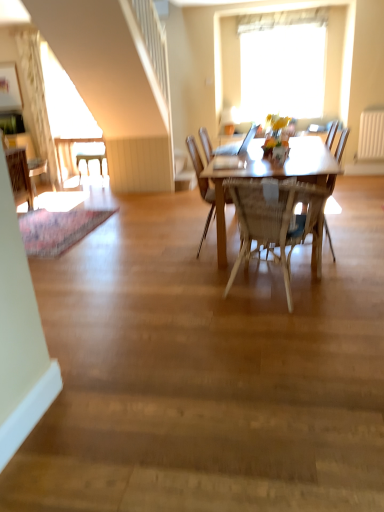
Describe the element at coordinates (279, 155) in the screenshot. I see `matte white vase at center` at that location.

Locate an element on the screen. The width and height of the screenshot is (384, 512). white plastic radiator at right is located at coordinates (371, 135).

In the scene shown: What is the approximate height of woven wood chair at center, marked as the 5th chair in a back-to-front arrangement?

woven wood chair at center, marked as the 5th chair in a back-to-front arrangement, is 30.78 inches in height.

What do you see at coordinates (37, 99) in the screenshot? I see `light beige textured curtain at upper left` at bounding box center [37, 99].

Where is `light beige textured curtain at upper left`? This screenshot has height=512, width=384. light beige textured curtain at upper left is located at coordinates (37, 99).

Where is `wooden chair at center, the 1th chair positioned from the right`? The height and width of the screenshot is (512, 384). wooden chair at center, the 1th chair positioned from the right is located at coordinates (297, 232).

From the image's perspective, relative to wooden chair at left, the fourth chair from the right, is white plastic radiator at right above or below?

white plastic radiator at right is situated higher than wooden chair at left, the fourth chair from the right, in the image.

Which point is more forward, (383,110) or (46,167)?

The point (383,110) is closer.

Can we say white plastic radiator at right lies outside wooden chair at left, the fourth chair from the right?

Yes.

Are white plastic radiator at right and wooden chair at left, the 4th chair positioned from the front, far apart?

Yes, white plastic radiator at right and wooden chair at left, the 4th chair positioned from the front, are located far from each other.

Can you confirm if light brown wooden table at center is thinner than transparent glass window at upper center?

In fact, light brown wooden table at center might be wider than transparent glass window at upper center.

Which point is more distant from viewer, (335, 168) or (249, 78)?

Positioned behind is point (249, 78).

From the image's perspective, which is below, light brown wooden table at center or transparent glass window at upper center?

light brown wooden table at center.

From a real-world perspective, which object stands above the other?

transparent glass window at upper center, from a real-world perspective.

Is transparent glass window at upper center at the right side of light beige textured curtain at upper left?

Indeed, transparent glass window at upper center is positioned on the right side of light beige textured curtain at upper left.

Identify the location of window above the light beige textured curtain at upper left (from the image's perspective). This screenshot has height=512, width=384. (283, 62).

Which of these two, transparent glass window at upper center or light beige textured curtain at upper left, is bigger?

With larger size is transparent glass window at upper center.

How different are the orientations of transparent glass window at upper center and light beige textured curtain at upper left in degrees?

The angle between the facing direction of transparent glass window at upper center and the facing direction of light beige textured curtain at upper left is 0.000721 degrees.

From a real-world perspective, which object stands above the other?

wooden chair at center, which is the fifth chair in left-to-right order, is physically above.

Considering the relative positions of light brown wooden table at center and wooden chair at center, the 1th chair positioned from the right, in the image provided, is light brown wooden table at center to the left or to the right of wooden chair at center, the 1th chair positioned from the right,?

Clearly, light brown wooden table at center is on the left of wooden chair at center, the 1th chair positioned from the right, in the image.

Is light brown wooden table at center turned away from wooden chair at center, the 1th chair positioned from the right?

Yes, light brown wooden table at center is positioned with its back facing wooden chair at center, the 1th chair positioned from the right.

Is woven wood chair at center, marked as the 5th chair in a back-to-front arrangement, turned away from white plastic chair at left, which is counted as the 1th chair, starting from the back?

woven wood chair at center, marked as the 5th chair in a back-to-front arrangement, does not have its back to white plastic chair at left, which is counted as the 1th chair, starting from the back.

Is woven wood chair at center, which appears as the 1th chair when viewed from the front, completely or partially outside of white plastic chair at left, which is counted as the 1th chair, starting from the back?

Yes, woven wood chair at center, which appears as the 1th chair when viewed from the front, is outside of white plastic chair at left, which is counted as the 1th chair, starting from the back.

Is woven wood chair at center, which appears as the 1th chair when viewed from the front, thinner than white plastic chair at left, which is the 5th chair from front to back?

No, woven wood chair at center, which appears as the 1th chair when viewed from the front, is not thinner than white plastic chair at left, which is the 5th chair from front to back.

Is woven wood chair at center, the 2th chair viewed from the right, taller than white plastic chair at left, which is the 5th chair from front to back?

Indeed, woven wood chair at center, the 2th chair viewed from the right, has a greater height compared to white plastic chair at left, which is the 5th chair from front to back.

Is wooden chair at center, the 1th chair positioned from the right, situated inside wooden chair at left, the 2th chair positioned from the back, or outside?

The correct answer is: outside.

Considering the relative positions of wooden chair at center, the fourth chair from the back, and wooden chair at left, the 2th chair positioned from the back, in the image provided, is wooden chair at center, the fourth chair from the back, to the left of wooden chair at left, the 2th chair positioned from the back, from the viewer's perspective?

No.

Looking at their sizes, would you say wooden chair at center, the 1th chair positioned from the right, is wider or thinner than wooden chair at left, which is counted as the 2th chair, starting from the left?

In the image, wooden chair at center, the 1th chair positioned from the right, appears to be more narrow than wooden chair at left, which is counted as the 2th chair, starting from the left.

How far apart are matte white vase at center and wooden chair at left, the 4th chair positioned from the front?

matte white vase at center is 3.54 meters away from wooden chair at left, the 4th chair positioned from the front.

Would you say matte white vase at center is outside wooden chair at left, the fourth chair from the right?

Yes, matte white vase at center is outside of wooden chair at left, the fourth chair from the right.

Which of these two, matte white vase at center or wooden chair at left, which is counted as the 2th chair, starting from the left, is thinner?

matte white vase at center.

Considering the relative sizes of matte white vase at center and wooden chair at left, the fourth chair from the right, in the image provided, is matte white vase at center taller than wooden chair at left, the fourth chair from the right,?

No.

Find the location of a particular element. the 1st chair positioned below the white plastic radiator at right (from a real-world perspective) is located at coordinates (36, 170).

This screenshot has height=512, width=384. I want to click on window that appears above the light brown wooden table at center (from a real-world perspective), so click(283, 62).

Which object lies nearer to the anchor point light brown wooden table at center, light beige textured curtain at upper left or wooden chair at center, the fourth chair from the back?

Based on the image, wooden chair at center, the fourth chair from the back, appears to be nearer to light brown wooden table at center.

When comparing their distances from white plastic radiator at right, does wooden chair at left, which is counted as the 2th chair, starting from the left, or woven wood chair at center, the 2th chair viewed from the right, seem closer?

The object closer to white plastic radiator at right is woven wood chair at center, the 2th chair viewed from the right.

Looking at this image, estimate the real-world distances between objects in this image. Which object is further from woven wood chair at center, marked as the 5th chair in a back-to-front arrangement, white glossy desk at left or matte white vase at center?

white glossy desk at left is positioned further to the anchor woven wood chair at center, marked as the 5th chair in a back-to-front arrangement.

Based on their spatial positions, is woven wood chair at center, the 2th chair viewed from the right, or white glossy desk at left further from wooden chair at center, the fourth chair from the back?

The object further to wooden chair at center, the fourth chair from the back, is white glossy desk at left.

In the scene shown: Which object lies nearer to the anchor point white glossy desk at left, white plastic chair at left, the 3th chair viewed from the left, or white plastic radiator at right?

white plastic chair at left, the 3th chair viewed from the left.

Looking at the image, which one is located closer to white plastic radiator at right, light beige textured curtain at upper left or white glossy desk at left?

The object closer to white plastic radiator at right is white glossy desk at left.

Estimate the real-world distances between objects in this image. Which object is further from wooden chair at left, which is counted as the 2th chair, starting from the left, light brown wooden table at center or wooden chair at left, arranged as the third chair when viewed from the front?

light brown wooden table at center.

Looking at this image, based on their spatial positions, is white plastic radiator at right or matte white vase at center further from woven wood chair at center, marked as the 5th chair in a back-to-front arrangement?

white plastic radiator at right lies further to woven wood chair at center, marked as the 5th chair in a back-to-front arrangement, than the other object.

The image size is (384, 512). Identify the location of desk located between wooden chair at left, arranged as the third chair when viewed from the front, and white plastic chair at left, the 3th chair viewed from the left, in the depth direction. (73, 143).

Where is `kitchen & dining room table located between wooden chair at left, the fourth chair from the right, and transparent glass window at upper center in the left-right direction`? kitchen & dining room table located between wooden chair at left, the fourth chair from the right, and transparent glass window at upper center in the left-right direction is located at coordinates (271, 175).

Image resolution: width=384 pixels, height=512 pixels. Find the location of `curtain between wooden chair at left, which is counted as the 2th chair, starting from the left, and white glossy desk at left from front to back`. curtain between wooden chair at left, which is counted as the 2th chair, starting from the left, and white glossy desk at left from front to back is located at coordinates (37, 99).

What are the coordinates of `vase between white plastic chair at left, the 3th chair viewed from the left, and white plastic radiator at right from left to right` in the screenshot? It's located at (279, 155).